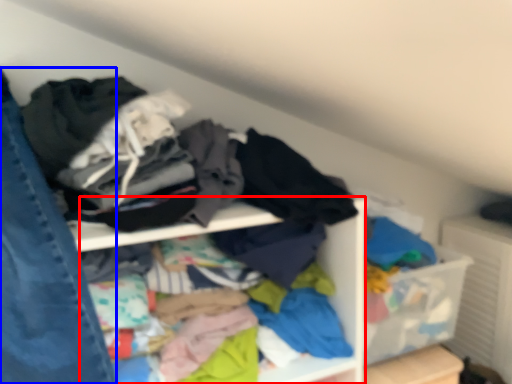
Question: Which of the following is the farthest to the observer, cabinet (highlighted by a red box) or jeans (highlighted by a blue box)?

Choices:
 (A) cabinet
 (B) jeans

Answer: (A)